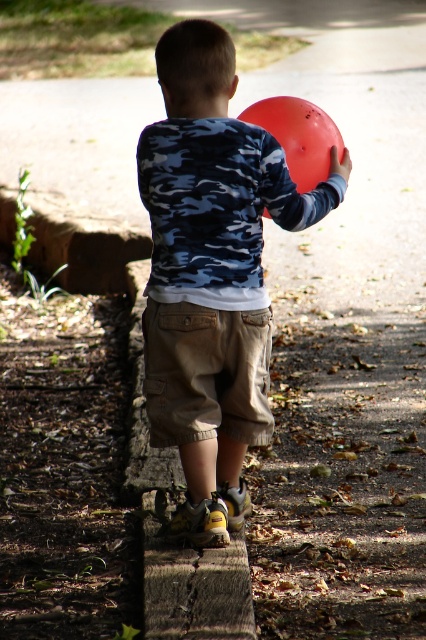
Is brown wood curb at lower center smaller than khaki cotton shorts at center?

Actually, brown wood curb at lower center might be larger than khaki cotton shorts at center.

Can you confirm if brown wood curb at lower center is thinner than khaki cotton shorts at center?

No, brown wood curb at lower center is not thinner than khaki cotton shorts at center.

Is point (155, 468) in front of point (178, 307)?

No, (155, 468) is further to viewer.

Find the location of `brown wood curb at lower center`. brown wood curb at lower center is located at coordinates (167, 516).

Does matte blue camouflage shirt at center appear on the right side of rubber balloon at back?

No, matte blue camouflage shirt at center is not to the right of rubber balloon at back.

Based on the photo, who is positioned more to the left, matte blue camouflage shirt at center or rubber balloon at back?

Positioned to the left is matte blue camouflage shirt at center.

Is point (184, 257) farther from viewer compared to point (296, 168)?

No, (184, 257) is closer to viewer.

Find the location of a particular element. The height and width of the screenshot is (640, 426). matte blue camouflage shirt at center is located at coordinates (212, 273).

Does matte blue camouflage shirt at center come in front of khaki cotton shorts at center?

Yes, matte blue camouflage shirt at center is in front of khaki cotton shorts at center.

In the scene shown: Who is shorter, matte blue camouflage shirt at center or khaki cotton shorts at center?

With less height is khaki cotton shorts at center.

In the scene shown: Who is more forward, [239,497] or [203,317]?

Point [203,317]

Find the location of a particular element. The image size is (426, 640). matte blue camouflage shirt at center is located at coordinates (212, 273).